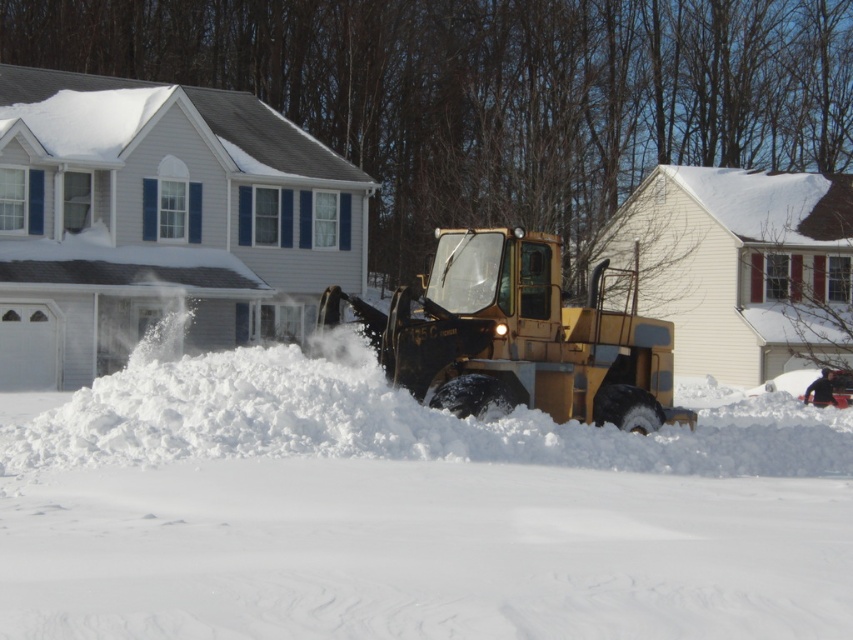
Between point (305, 540) and point (479, 374), which one is positioned in front?

Point (305, 540) is more forward.

Is point (827, 598) closer to camera compared to point (519, 237)?

Yes, point (827, 598) is closer to viewer.

The width and height of the screenshot is (853, 640). What do you see at coordinates (410, 515) in the screenshot?
I see `white fluffy snow at center` at bounding box center [410, 515].

This screenshot has width=853, height=640. I want to click on white fluffy snow at center, so click(410, 515).